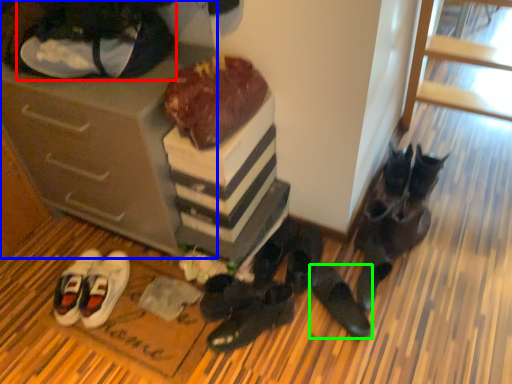
Question: Which is nearer to the footwear (highlighted by a red box)? cabinetry (highlighted by a blue box) or footwear (highlighted by a green box).

Choices:
 (A) cabinetry
 (B) footwear

Answer: (A)